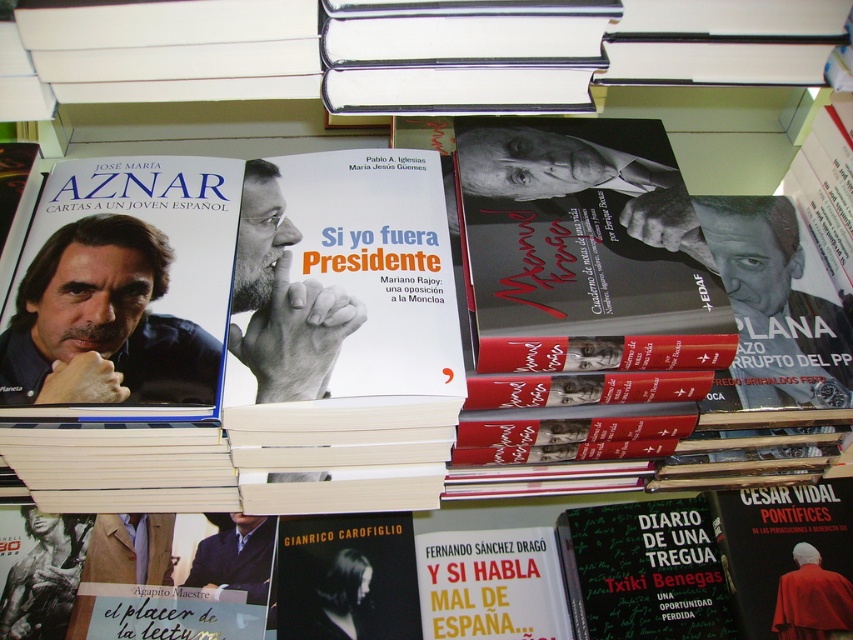
Question: Can you confirm if matte black book cover at center is bigger than dark blue suit at center?

Choices:
 (A) yes
 (B) no

Answer: (A)

Question: In this image, where is matte black book at center located relative to matte black book cover at center?

Choices:
 (A) right
 (B) left

Answer: (B)

Question: Which point appears farthest from the camera in this image?

Choices:
 (A) (212, 227)
 (B) (177, 374)
 (C) (828, 605)

Answer: (C)

Question: Which of the following is the closest to the observer?

Choices:
 (A) green matte book at lower center
 (B) red velvet robe at lower right

Answer: (B)

Question: Does matte black book at center appear over matte black book cover at center?

Choices:
 (A) yes
 (B) no

Answer: (B)

Question: Which is farther from the matte black book cover at left?

Choices:
 (A) matte black book at center
 (B) matte black book cover at center

Answer: (B)